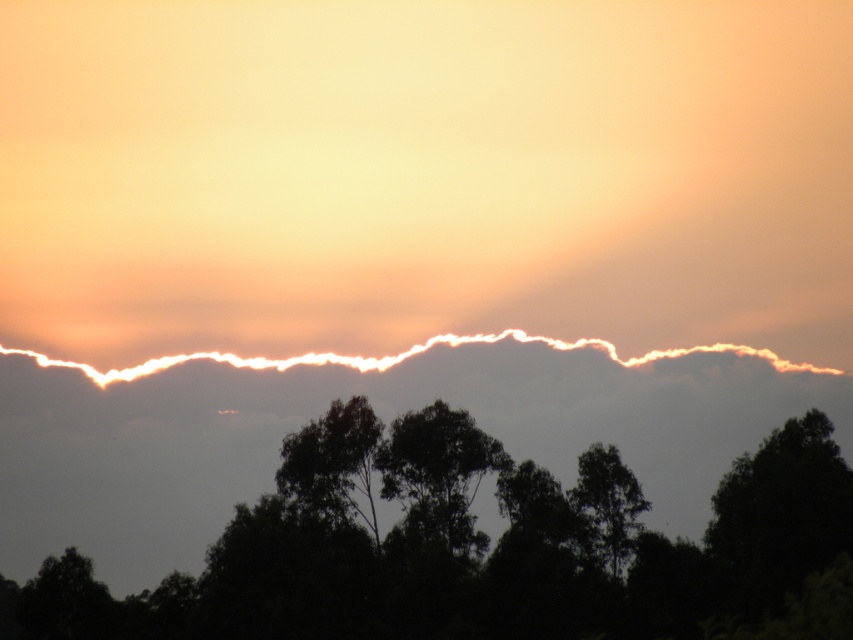
Question: Does white fluffy cloud at upper center appear on the left side of green leafy tree at center?

Choices:
 (A) yes
 (B) no

Answer: (B)

Question: Among these objects, which one is farthest from the camera?

Choices:
 (A) silhouette leafy tree at center
 (B) dark green leafy tree at center

Answer: (A)

Question: Which of the following is the closest to the observer?

Choices:
 (A) white fluffy cloud at upper center
 (B) green leafy tree at center
 (C) dark green leafy tree at center

Answer: (C)

Question: Where is green leafy tree at center located in relation to dark green leafy tree at center in the image?

Choices:
 (A) left
 (B) right

Answer: (A)

Question: Is green leafy tree at center closer to the viewer compared to dark green leafy tree at center?

Choices:
 (A) no
 (B) yes

Answer: (A)

Question: Which is nearer to the silhouette leafy tree at center?

Choices:
 (A) dark green leafy tree at center
 (B) white fluffy cloud at upper center
 (C) green leafy tree at center

Answer: (C)